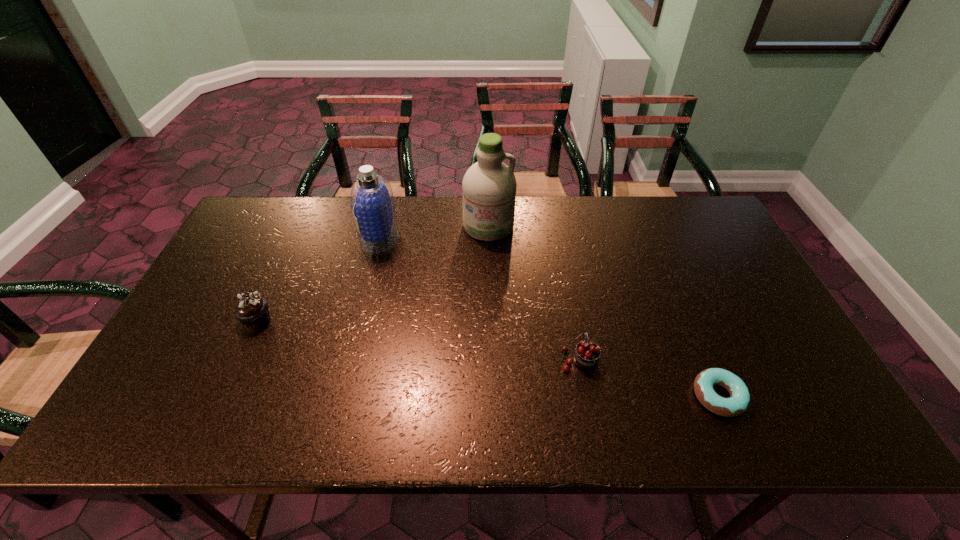
At what (x,y) coordinates should I click in order to perform the action: click on the taller cleansing agent. Please return your answer as a coordinate pair (x, y). Looking at the image, I should click on 489,186.

Locate an element on the screen. The width and height of the screenshot is (960, 540). the tallest object is located at coordinates (489, 186).

Where is `the shorter cleansing agent`? the shorter cleansing agent is located at coordinates pos(372,202).

You are a GUI agent. You are given a task and a screenshot of the screen. Output one action in this format:
    pyautogui.click(x=<x>, y=<y>)
    Task: Click on the fourth object from right to left
    The height and width of the screenshot is (540, 960).
    Given the screenshot: What is the action you would take?
    pyautogui.click(x=372, y=202)

This screenshot has height=540, width=960. I want to click on cherry, so click(587, 353).

Image resolution: width=960 pixels, height=540 pixels. Identify the location of the fourth farthest object. (587, 353).

Image resolution: width=960 pixels, height=540 pixels. Identify the location of cupcake. (251, 309).

Locate an element on the screen. the third nearest object is located at coordinates (251, 309).

Where is `the rightmost object`? The height and width of the screenshot is (540, 960). the rightmost object is located at coordinates (738, 403).

Image resolution: width=960 pixels, height=540 pixels. What are the coordinates of `the nearest object` in the screenshot? It's located at (738, 403).